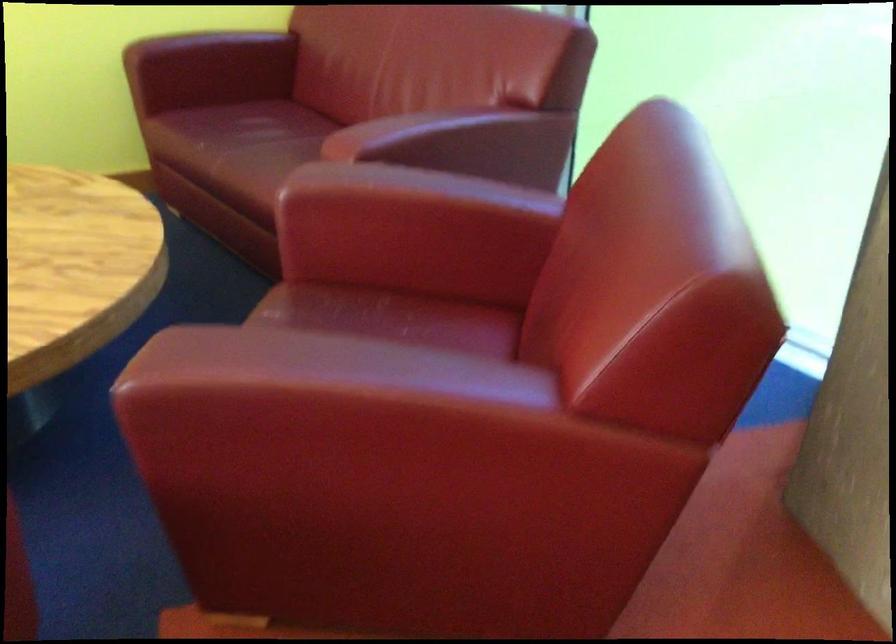
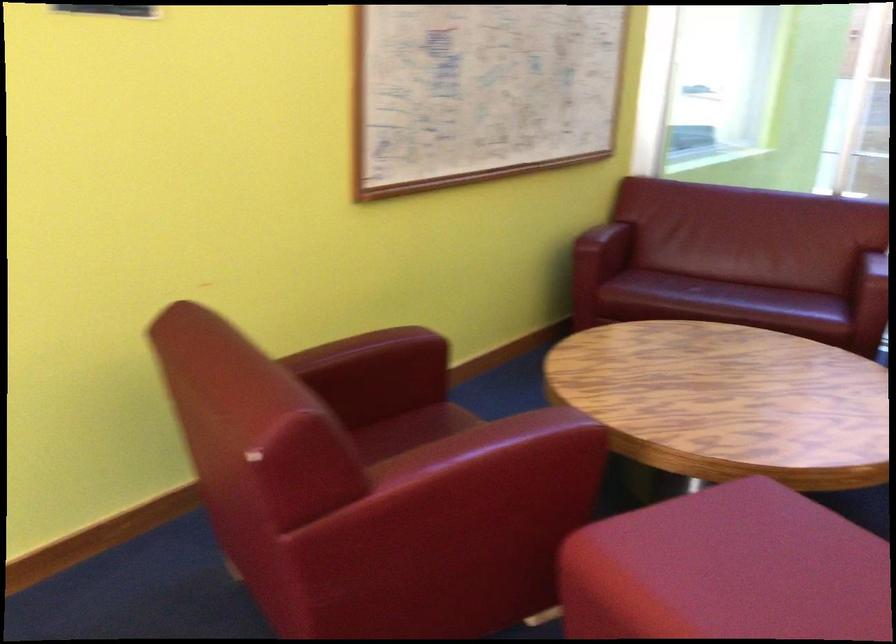
In the second image, find the point that corresponds to (220,152) in the first image.

(719, 297)